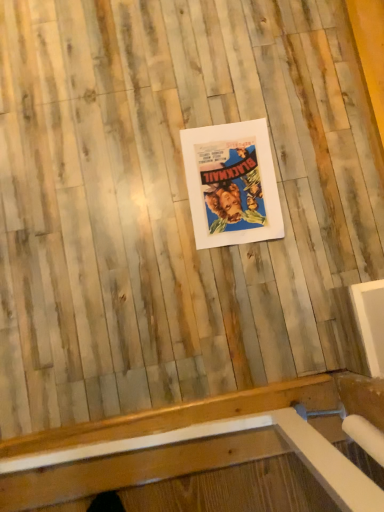
At what (x,y) coordinates should I click in order to perform the action: click on free space underneath white matte picture frame at center (from a real-world perspective). Please return your answer as a coordinate pair (x, y). The width and height of the screenshot is (384, 512). Looking at the image, I should click on (230, 185).